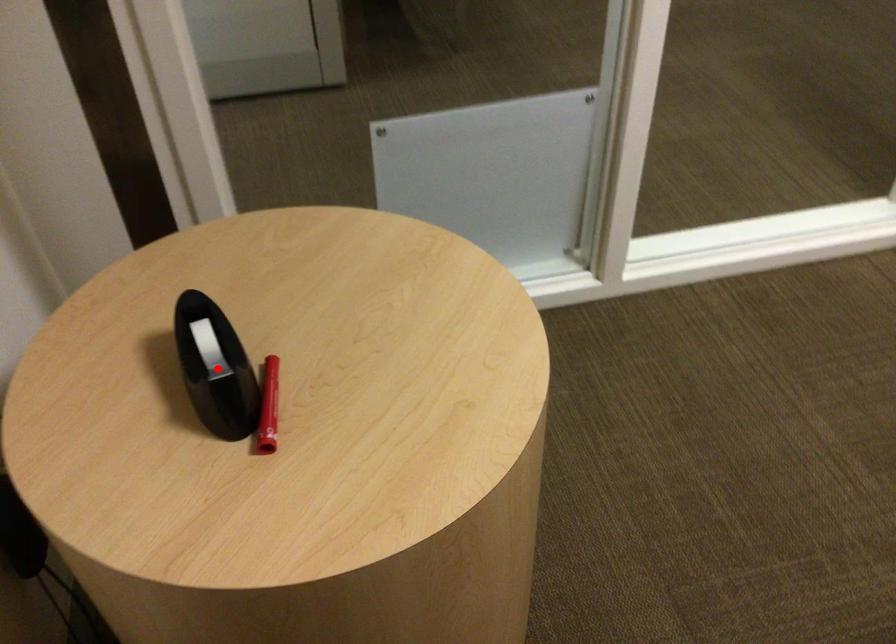
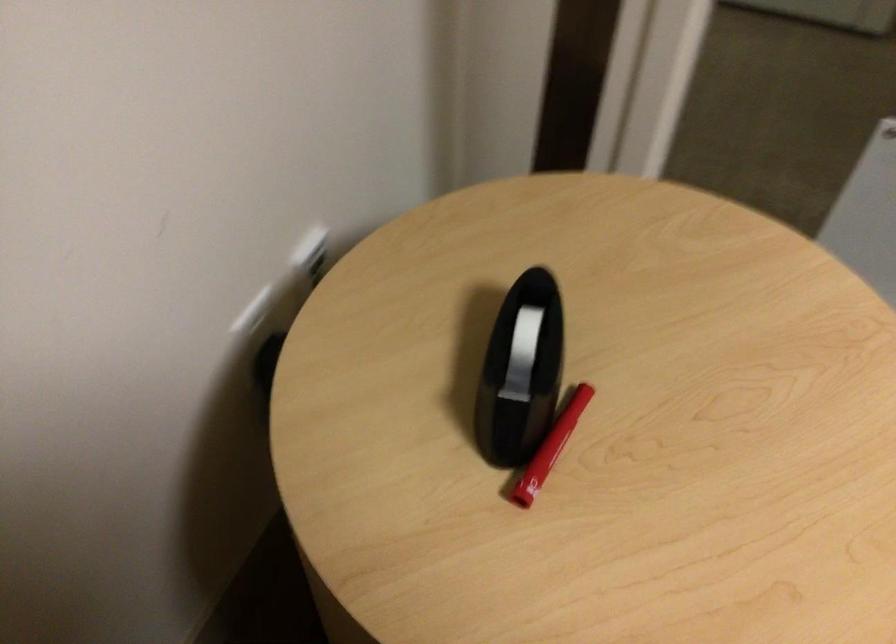
Find the pixel in the second image that matches the highlighted location in the first image.

(521, 371)